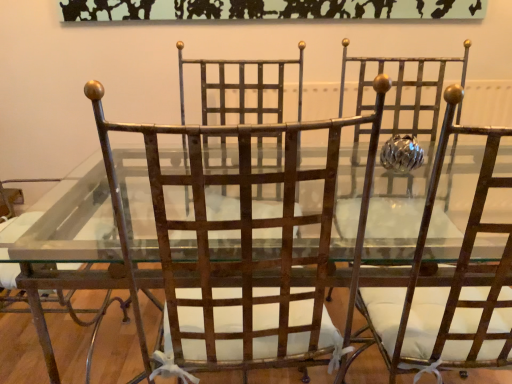
Question: Looking at their shapes, would you say rusty metal chair at center, acting as the 2th chair starting from the left, is wider or thinner than rusty metal chair at center, arranged as the 1th chair when viewed from the right?

Choices:
 (A) wide
 (B) thin

Answer: (B)

Question: In the image, is rusty metal chair at center, acting as the 2th chair starting from the left, on the left side or the right side of rusty metal chair at center, arranged as the 1th chair when viewed from the right?

Choices:
 (A) right
 (B) left

Answer: (B)

Question: Based on their relative distances, which object is farther from the rusty metal chair at left, arranged as the 1th chair when viewed from the left?

Choices:
 (A) rusty metal chair at center, which appears as the 3th chair when viewed from the left
 (B) rusty metal chair at center, acting as the 2th chair starting from the left

Answer: (A)

Question: Considering the real-world distances, which object is closest to the rusty metal chair at center, which appears as the 3th chair when viewed from the left?

Choices:
 (A) rusty metal chair at center, which is counted as the 2th chair, starting from the right
 (B) rusty metal chair at left, marked as the 3th chair in a right-to-left arrangement

Answer: (A)